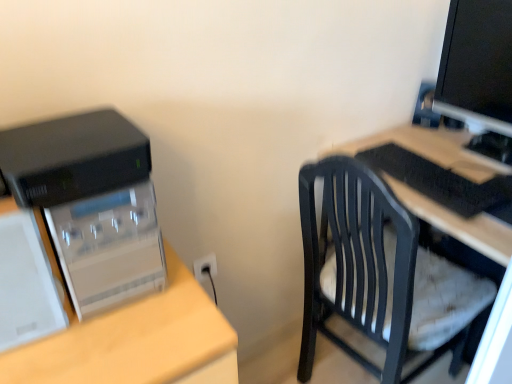
What do you see at coordinates (442, 182) in the screenshot? I see `black plastic keyboard at right` at bounding box center [442, 182].

In order to face black plastic computer tower at left, should I rotate leftwards or rightwards?

Rotate left and turn 20.225 degrees.

Locate an element on the screen. black plastic keyboard at right is located at coordinates (442, 182).

Which object is positioned more to the left, black plastic chair at right or black plastic electric outlet at center?

Positioned to the left is black plastic electric outlet at center.

From the image's perspective, is black plastic chair at right beneath black plastic electric outlet at center?

Correct, black plastic chair at right appears lower than black plastic electric outlet at center in the image.

Is point (385, 222) positioned after point (211, 273)?

No, (385, 222) is in front of (211, 273).

Considering the relative sizes of black plastic keyboard at right and black plastic computer tower at left in the image provided, is black plastic keyboard at right wider than black plastic computer tower at left?

No.

Between point (383, 148) and point (56, 148), which one is positioned behind?

The point (383, 148) is farther from the camera.

From the picture: How different are the orientations of black plastic keyboard at right and black plastic computer tower at left in degrees?

There is a 92.6-degree angle between the facing directions of black plastic keyboard at right and black plastic computer tower at left.

Considering the positions of point (490, 141) and point (356, 201), is point (490, 141) closer or farther from the camera than point (356, 201)?

Clearly, point (490, 141) is more distant from the camera than point (356, 201).

Who is more distant, black glossy monitor at upper right or black plastic chair at right?

black glossy monitor at upper right is behind.

Can you confirm if black glossy monitor at upper right is taller than black plastic chair at right?

No, black glossy monitor at upper right is not taller than black plastic chair at right.

Is black glossy monitor at upper right at the right side of black plastic chair at right?

Correct, you'll find black glossy monitor at upper right to the right of black plastic chair at right.

From a real-world perspective, which is physically above, black glossy monitor at upper right or black plastic electric outlet at center?

From a 3D spatial view, black glossy monitor at upper right is above.

In the scene shown: Is black glossy monitor at upper right in contact with black plastic electric outlet at center?

black glossy monitor at upper right and black plastic electric outlet at center are clearly separated.

Is black glossy monitor at upper right surrounding black plastic electric outlet at center?

No, black plastic electric outlet at center is not a part of black glossy monitor at upper right.

From the image's perspective, between black plastic electric outlet at center and black glossy monitor at upper right, which one is located above?

black glossy monitor at upper right is shown above in the image.

Can we say black plastic electric outlet at center lies outside black glossy monitor at upper right?

Indeed, black plastic electric outlet at center is completely outside black glossy monitor at upper right.

What's the angular difference between black plastic electric outlet at center and black glossy monitor at upper right's facing directions?

87.6 degrees separate the facing orientations of black plastic electric outlet at center and black glossy monitor at upper right.

Is point (205, 264) closer or farther from the camera than point (493, 66)?

Point (205, 264).

Does point (87, 224) come closer to viewer compared to point (469, 49)?

Yes, it is in front of point (469, 49).

Measure the distance from black plastic computer tower at left to black glossy monitor at upper right.

black plastic computer tower at left is 1.22 meters from black glossy monitor at upper right.

Is black plastic computer tower at left shorter than black glossy monitor at upper right?

Correct, black plastic computer tower at left is not as tall as black glossy monitor at upper right.

From the image's perspective, which is above, black plastic computer tower at left or black plastic electric outlet at center?

black plastic computer tower at left is shown above in the image.

Would you say black plastic computer tower at left is outside black plastic electric outlet at center?

That's correct, black plastic computer tower at left is outside of black plastic electric outlet at center.

Would you consider black plastic computer tower at left to be distant from black plastic electric outlet at center?

No, black plastic computer tower at left is not far from black plastic electric outlet at center.

From a real-world perspective, is black plastic computer tower at left positioned under black plastic electric outlet at center based on gravity?

No.

Identify the location of chair on the right of black plastic electric outlet at center. The width and height of the screenshot is (512, 384). point(357,263).

Find the location of a particular element. Image resolution: width=512 pixels, height=384 pixels. computer tower lying on the left of black plastic keyboard at right is located at coordinates (91, 204).

Which object lies further to the anchor point black plastic keyboard at right, black glossy monitor at upper right or black plastic computer tower at left?

Among the two, black plastic computer tower at left is located further to black plastic keyboard at right.

When comparing their distances from black glossy monitor at upper right, does black plastic computer tower at left or black plastic chair at right seem further?

Among the two, black plastic computer tower at left is located further to black glossy monitor at upper right.

From the picture: Based on their spatial positions, is black glossy monitor at upper right or black plastic computer tower at left further from black plastic electric outlet at center?

black glossy monitor at upper right is further to black plastic electric outlet at center.

When comparing their distances from black plastic chair at right, does black plastic keyboard at right or black plastic computer tower at left seem closer?

black plastic keyboard at right lies closer to black plastic chair at right than the other object.

When comparing their distances from black plastic chair at right, does black plastic computer tower at left or black plastic keyboard at right seem further?

black plastic computer tower at left lies further to black plastic chair at right than the other object.

Based on their spatial positions, is black plastic electric outlet at center or black plastic chair at right further from black plastic computer tower at left?

Based on the image, black plastic electric outlet at center appears to be further to black plastic computer tower at left.

Which object lies nearer to the anchor point black glossy monitor at upper right, black plastic computer tower at left or black plastic keyboard at right?

Based on the image, black plastic keyboard at right appears to be nearer to black glossy monitor at upper right.

Which object lies further to the anchor point black plastic chair at right, black plastic keyboard at right or black glossy monitor at upper right?

Based on the image, black glossy monitor at upper right appears to be further to black plastic chair at right.

This screenshot has height=384, width=512. Identify the location of chair located between black plastic computer tower at left and black glossy monitor at upper right in the left-right direction. (357, 263).

Locate an element on the screen. Image resolution: width=512 pixels, height=384 pixels. keyboard between black plastic electric outlet at center and black plastic chair at right from left to right is located at coordinates (442, 182).

At what (x,y) coordinates should I click in order to perform the action: click on keyboard between black plastic computer tower at left and black glossy monitor at upper right. Please return your answer as a coordinate pair (x, y). Looking at the image, I should click on (442, 182).

Locate an element on the screen. keyboard located between black plastic computer tower at left and black plastic chair at right in the left-right direction is located at coordinates 442,182.